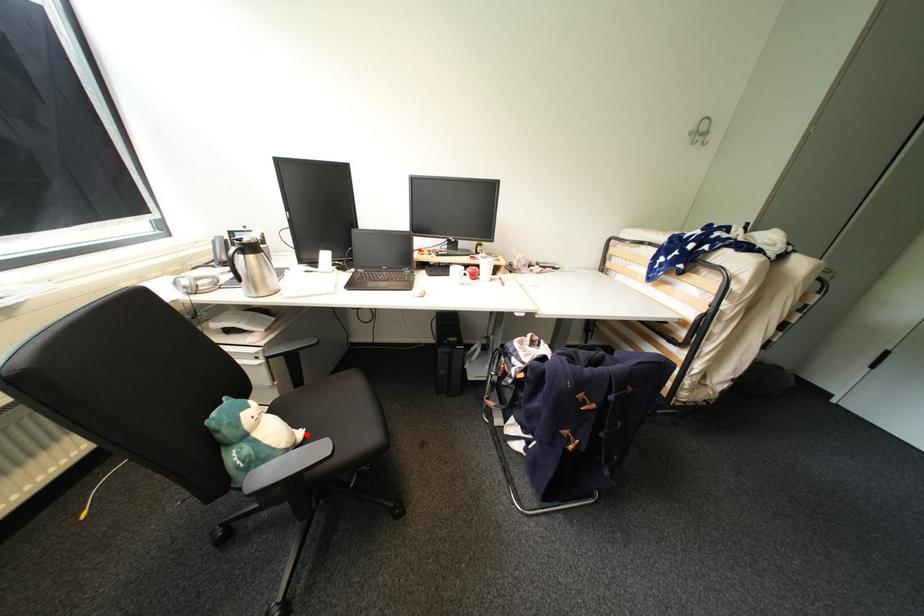
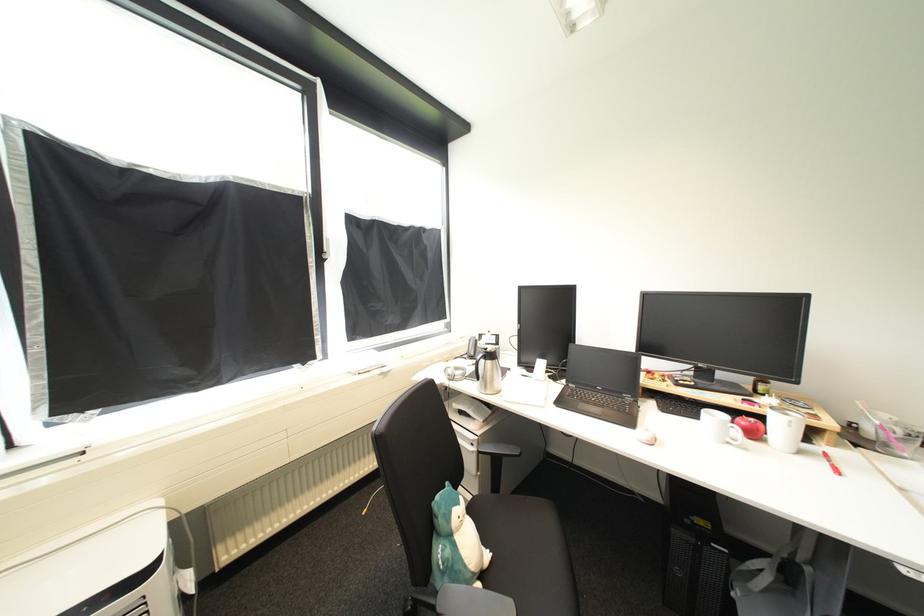
Question: I am providing you with two images of the same scene from different viewpoints. Given a red point in image1, look at the same physical point in image2. Is it:

Choices:
 (A) Closer to the viewpoint
 (B) Farther from the viewpoint

Answer: (B)